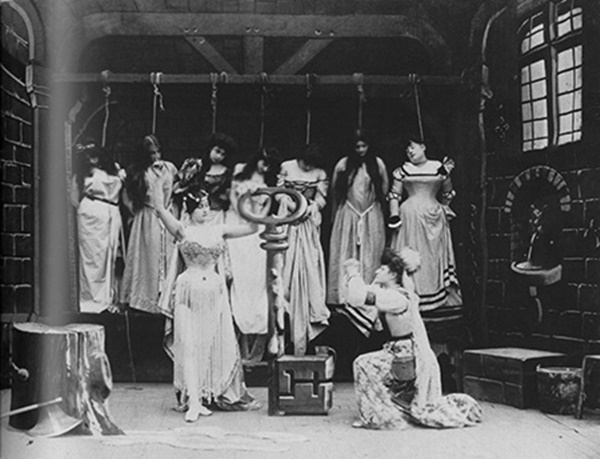
I want to click on wood bucket, so click(x=543, y=385).